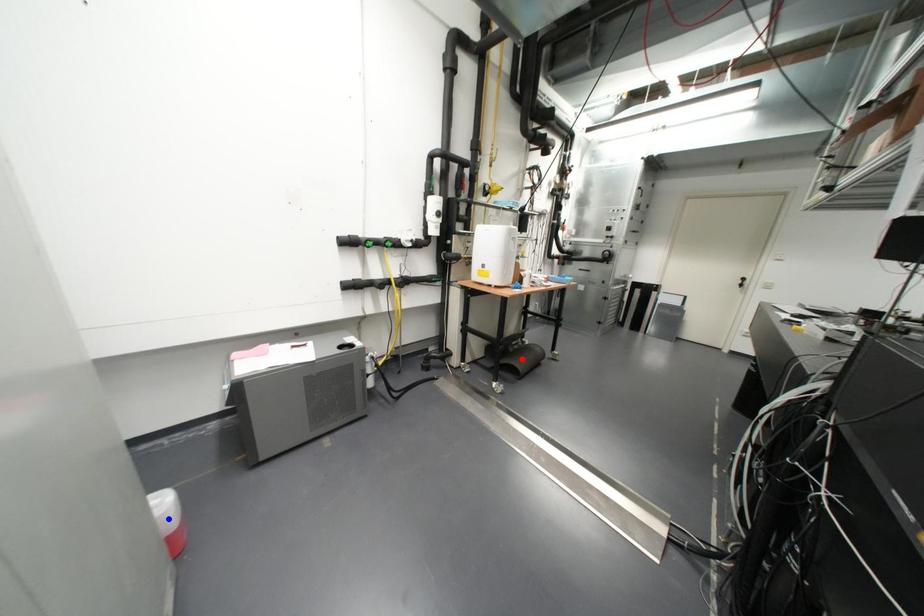
Question: In the image, two points are highlighted. Which point is nearer to the camera? Reply with the corresponding letter.

Choices:
 (A) blue point
 (B) red point

Answer: (A)